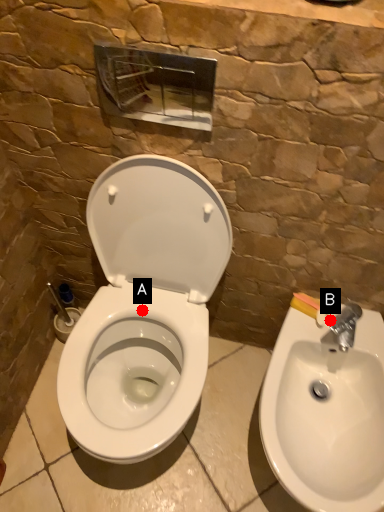
Question: Two points are circled on the image, labeled by A and B beside each circle. Which point appears farthest from the camera in this image?

Choices:
 (A) A is further
 (B) B is further

Answer: (A)